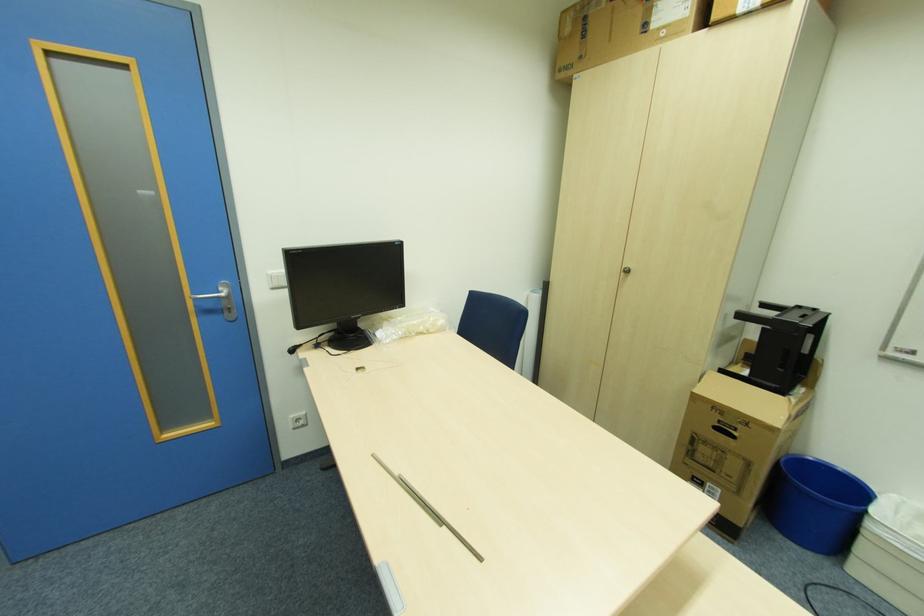
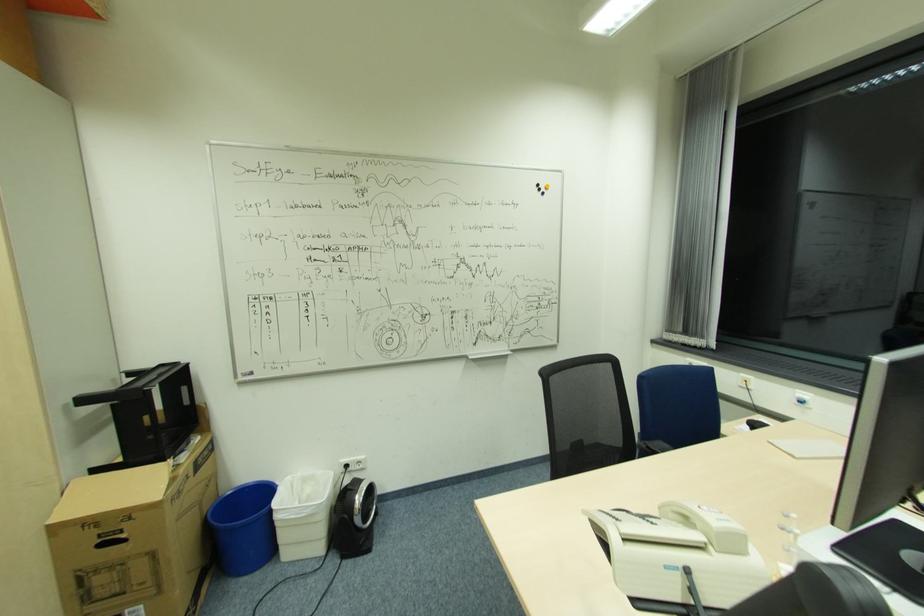
Question: The camera is either moving clockwise (left) or counter-clockwise (right) around the object. The first image is from the beginning of the video and the second image is from the end. Is the camera moving left or right when shooting the video?

Choices:
 (A) Left
 (B) Right

Answer: (A)